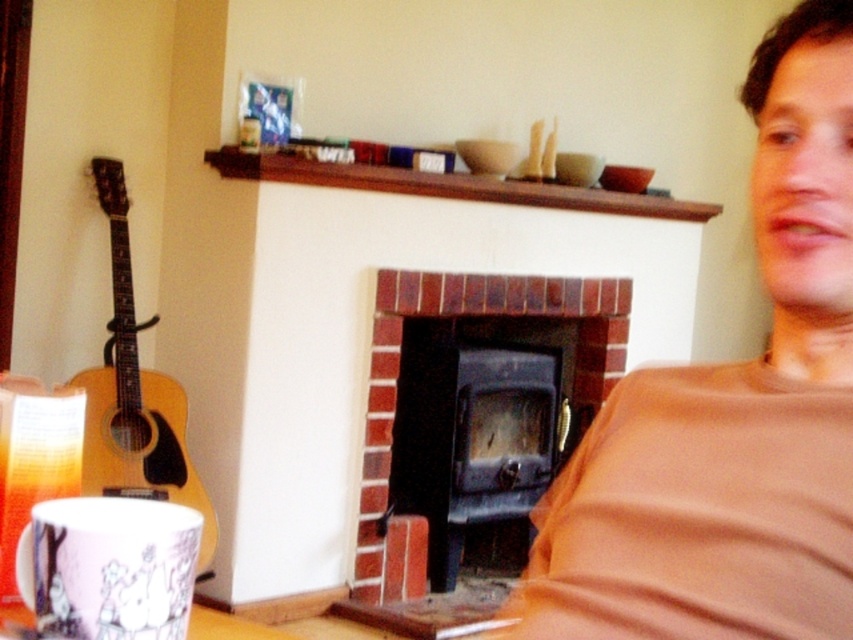
You are trying to decide whether to place a new rectangular shelf between the brown cotton shirt at right and the acoustic wood guitar at left. The shelf is 1.2 meters wide. Can the shelf fit between them based on their widths?

The brown cotton shirt at right has a lesser width compared to acoustic wood guitar at left. Since the shelf is 1.2 meters wide, but there is no information provided about the actual distance between the two objects, it is impossible to determine if the shelf will fit solely based on their widths.

Consider the image. You are planning to place a new decorative item on the brick fireplace at center and the acoustic wood guitar at left. Based on their sizes, which one can accommodate a larger item?

The brick fireplace at center can accommodate a larger item because it is larger in size than the acoustic wood guitar at left.

You are standing in the living room and want to place a 1.5 meter long decorative shelf on the brick fireplace at center. Can you fit it horizontally on the mantel?

The brick fireplace at center is 2.62 meters away from camera. Since the shelf is 1.5 meters long, it can fit horizontally on the mantel as the distance from the camera does not affect the mantel width. However, the mantel width isn not provided, so we cannot confirm if it will fit.